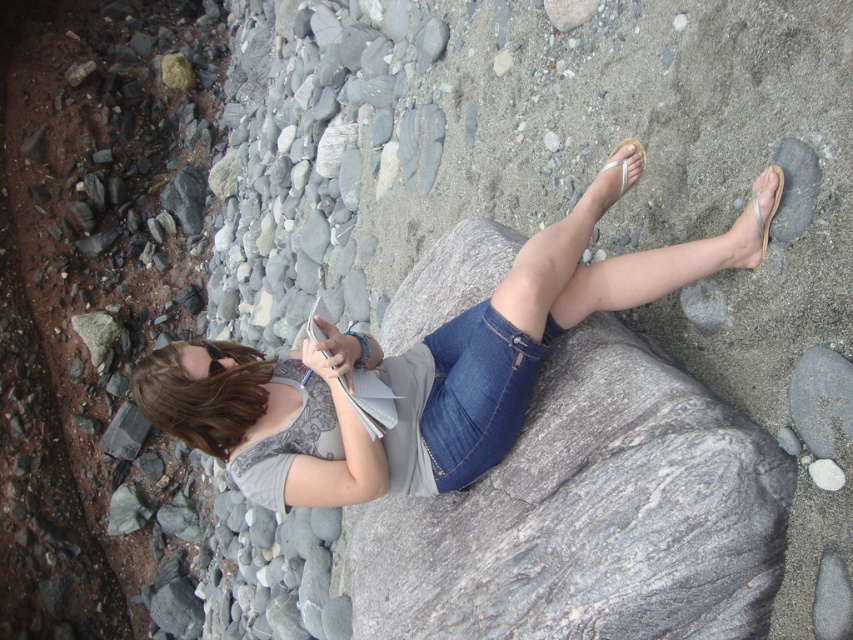
Question: Where is gray/granite boulder at center located in relation to denim shorts at center in the image?

Choices:
 (A) above
 (B) below

Answer: (B)

Question: Which of these objects is positioned closest to the gray/granite boulder at center?

Choices:
 (A) brown hair at center
 (B) denim shorts at center

Answer: (B)

Question: Is gray/granite boulder at center above brown hair at center?

Choices:
 (A) no
 (B) yes

Answer: (A)

Question: Which point appears farthest from the camera in this image?

Choices:
 (A) (227, 376)
 (B) (393, 460)
 (C) (477, 552)

Answer: (B)

Question: Which point is closer to the camera?

Choices:
 (A) (160, 348)
 (B) (486, 572)
 (C) (341, 493)

Answer: (B)

Question: Is gray/granite boulder at center to the right of brown hair at center from the viewer's perspective?

Choices:
 (A) yes
 (B) no

Answer: (A)